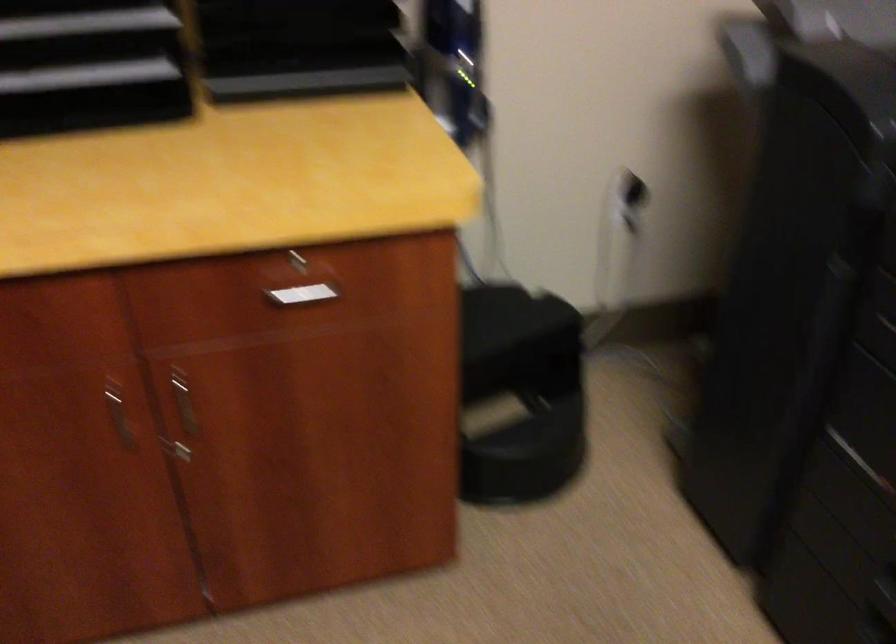
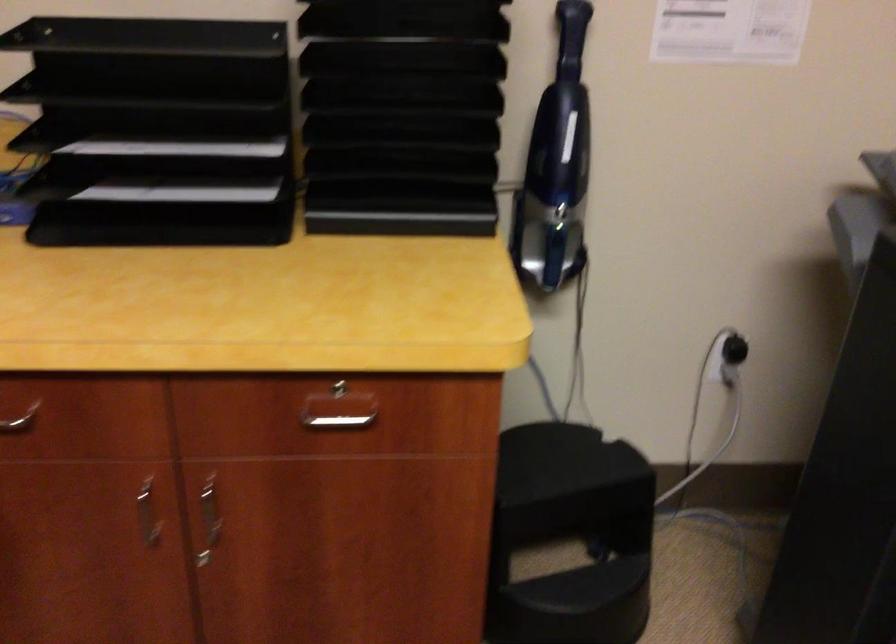
Where in the second image is the point corresponding to pixel 300 295 from the first image?

(338, 422)